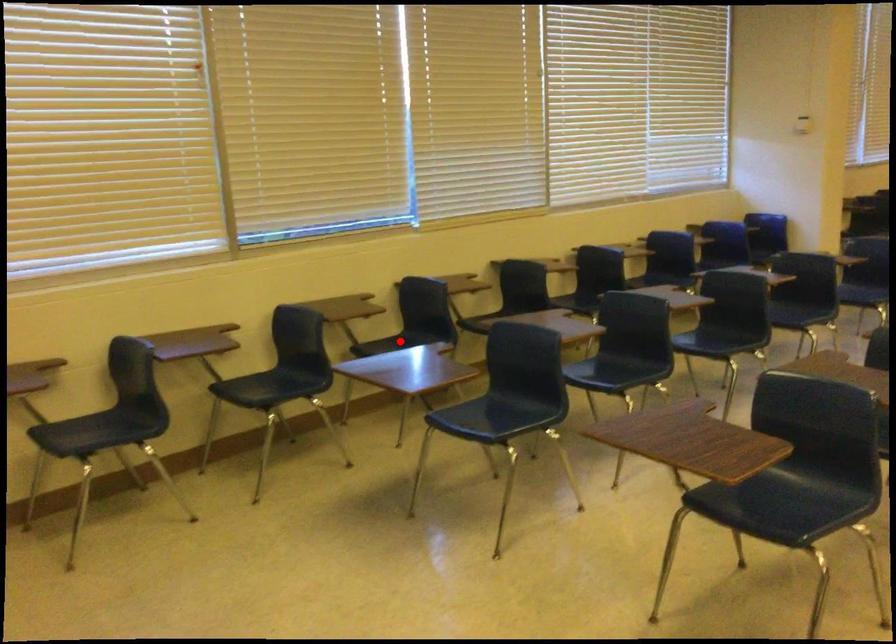
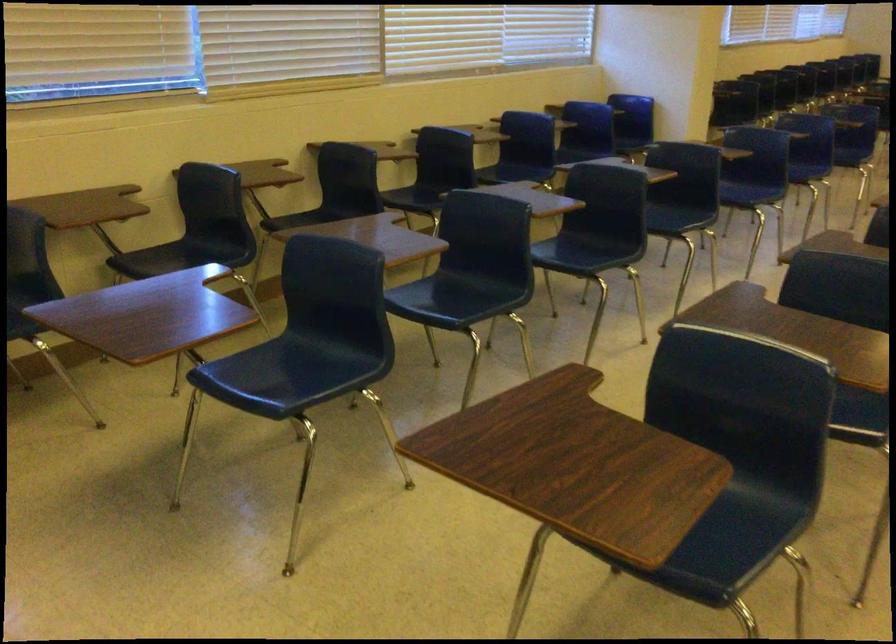
Question: I am providing you with two images of the same scene from different viewpoints. In image1, a red point is highlighted. Considering the same 3D point in image2, which of the following is correct?

Choices:
 (A) It is closer
 (B) It is farther

Answer: (A)